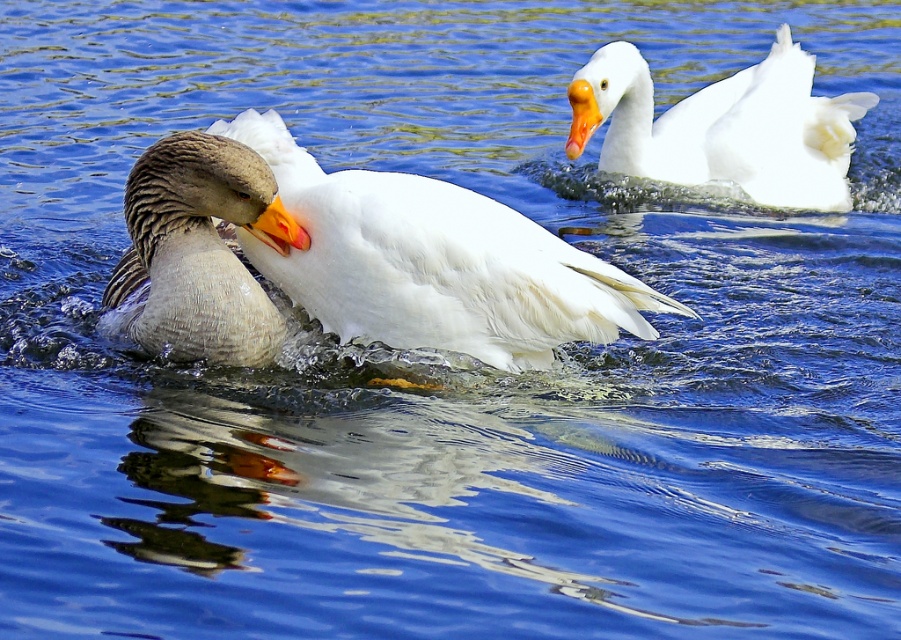
Question: Estimate the real-world distances between objects in this image. Which object is closer to the gray feathered duck at center?

Choices:
 (A) white matte duck at upper right
 (B) orange matte beak at center
 (C) white feathered duck at center
 (D) orange glossy beak at upper right

Answer: (B)

Question: Which point is farther to the camera?

Choices:
 (A) gray feathered duck at center
 (B) orange matte beak at center

Answer: (B)

Question: Is gray feathered duck at center behind white matte duck at upper right?

Choices:
 (A) no
 (B) yes

Answer: (A)

Question: Can you confirm if gray feathered duck at center is smaller than white matte duck at upper right?

Choices:
 (A) yes
 (B) no

Answer: (A)

Question: Estimate the real-world distances between objects in this image. Which object is closer to the orange matte beak at center?

Choices:
 (A) white matte duck at upper right
 (B) white feathered duck at center
 (C) gray feathered duck at center

Answer: (C)

Question: Does gray feathered duck at center have a lesser width compared to orange matte beak at center?

Choices:
 (A) yes
 (B) no

Answer: (B)